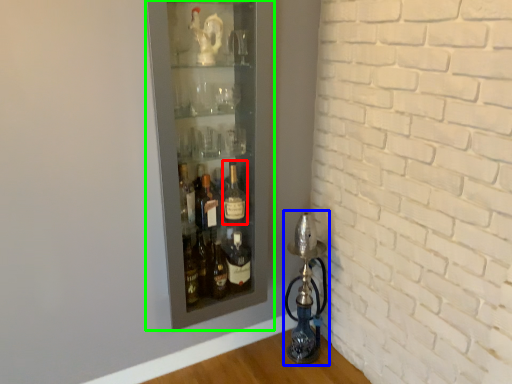
Question: Which is nearer to the bottle (highlighted by a red box)? oil lamp (highlighted by a blue box) or shelf (highlighted by a green box).

Choices:
 (A) oil lamp
 (B) shelf

Answer: (B)